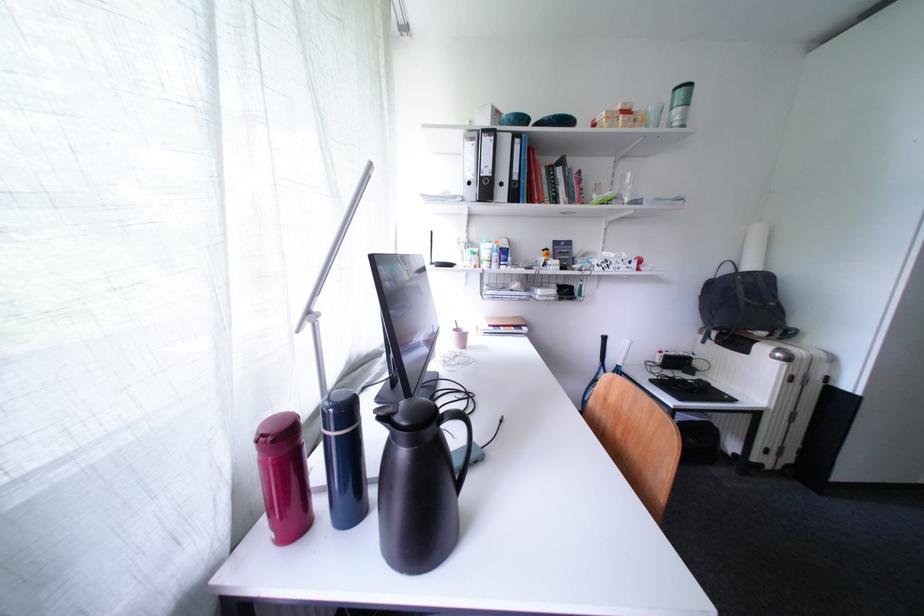
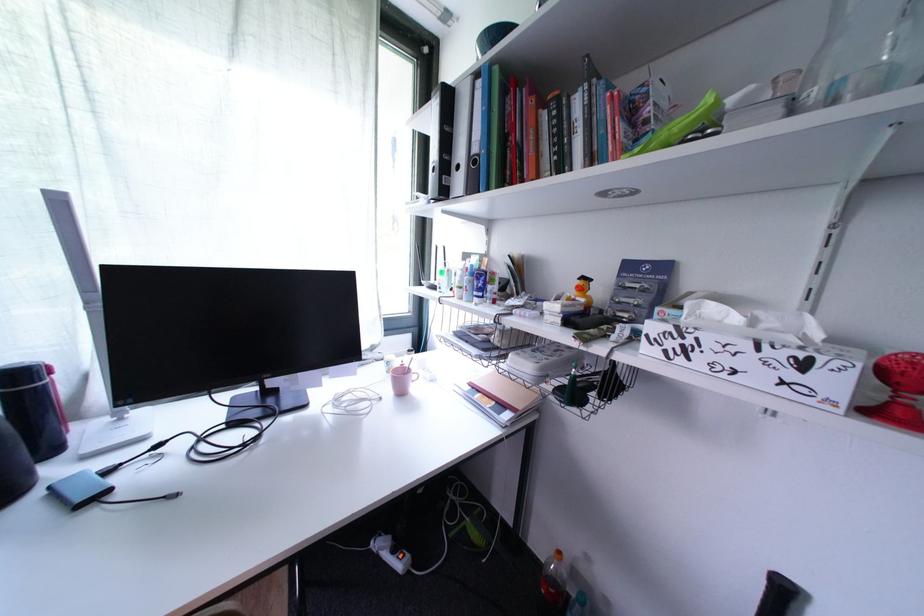
The point at (552, 253) is marked in the first image. Where is the corresponding point in the second image?

(588, 282)